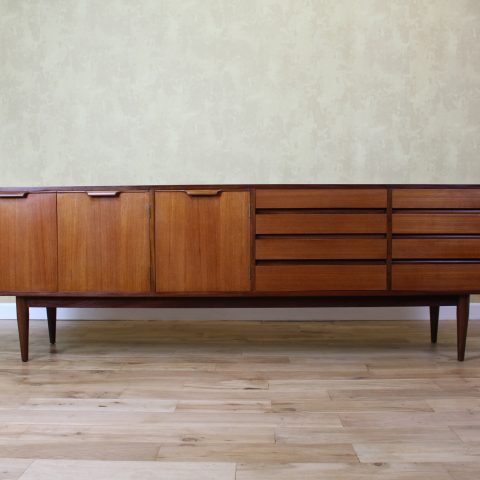
At what (x,y) coordinates should I click in order to perform the action: click on light brown hardwood flooring. Please return your answer as a coordinate pair (x, y). The image size is (480, 480). Looking at the image, I should click on (245, 447).